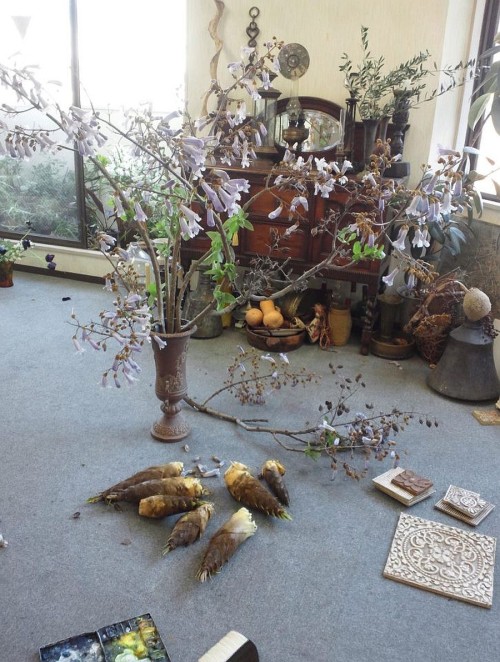
The height and width of the screenshot is (662, 500). In order to click on bright light reflecting through window in this screenshot , I will do `click(126, 26)`.